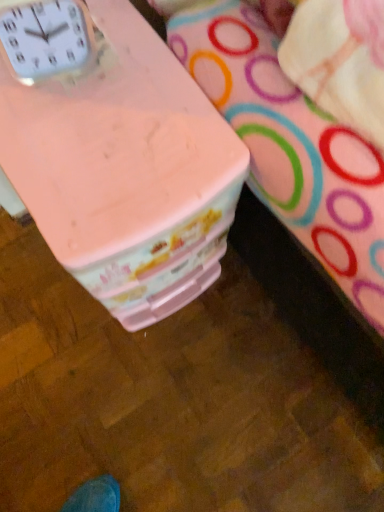
The image size is (384, 512). What are the coordinates of `free space in front of white plastic clock at upper left` in the screenshot? It's located at (75, 152).